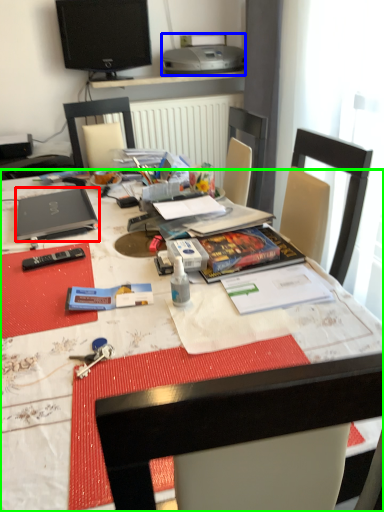
Question: Considering the real-world distances, which object is closest to laptop (highlighted by a red box)? printer (highlighted by a blue box) or desk (highlighted by a green box).

Choices:
 (A) printer
 (B) desk

Answer: (B)